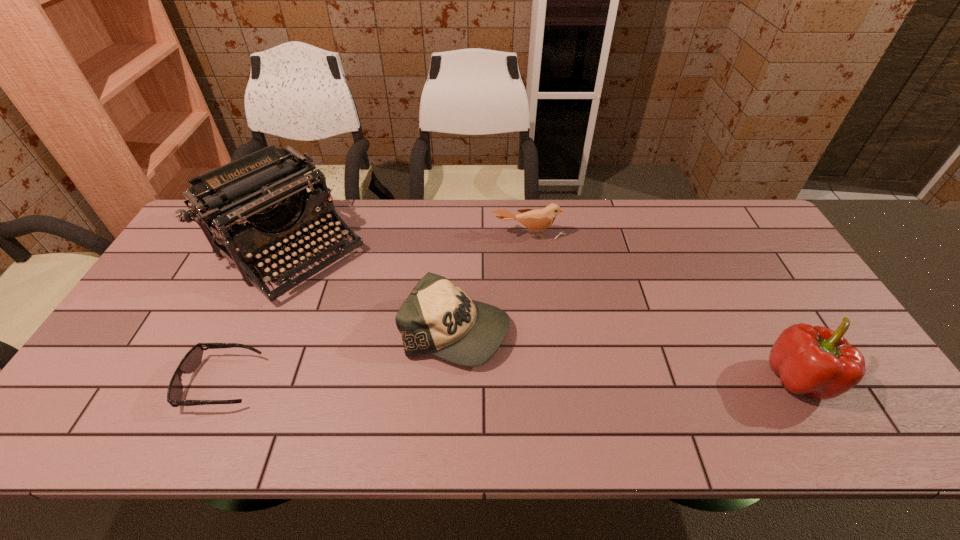
Locate an element on the screen. blank area located at the beak of the bird is located at coordinates (537, 341).

Identify the location of free location located on the typing side of the typewriter. (354, 302).

Find the location of a particular element. blank space located on the typing side of the typewriter is located at coordinates (404, 342).

Locate an element on the screen. free location located 0.120m on the typing side of the typewriter is located at coordinates (361, 307).

Where is `free space located 0.190m on the front-facing side of the baseball cap`? The height and width of the screenshot is (540, 960). free space located 0.190m on the front-facing side of the baseball cap is located at coordinates (572, 384).

The image size is (960, 540). Identify the location of vacant space situated 0.070m on the front-facing side of the baseball cap. (527, 362).

You are a GUI agent. You are given a task and a screenshot of the screen. Output one action in this format:
    pyautogui.click(x=<x>, y=<y>)
    Task: Click on the free space located on the front-facing side of the baseball cap
    
    Given the screenshot: What is the action you would take?
    pyautogui.click(x=595, y=396)

This screenshot has height=540, width=960. I want to click on bird that is at the far edge, so click(537, 220).

The image size is (960, 540). What are the coordinates of `typewriter that is at the far edge` in the screenshot? It's located at (262, 198).

Image resolution: width=960 pixels, height=540 pixels. I want to click on sunglasses that is at the near edge, so click(x=189, y=363).